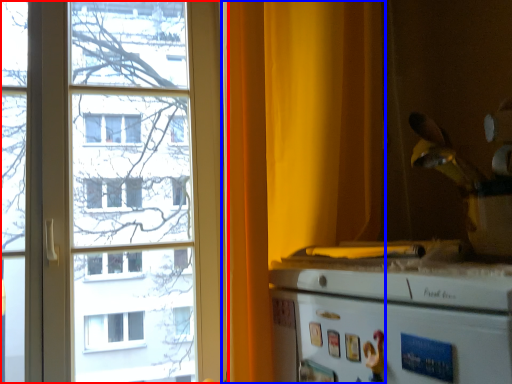
Question: Which object appears farthest to the camera in this image, window (highlighted by a red box) or curtain (highlighted by a blue box)?

Choices:
 (A) window
 (B) curtain

Answer: (A)